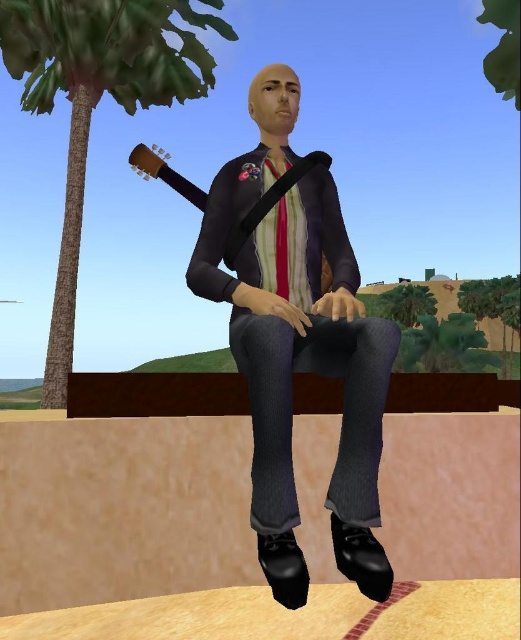
You are a game character trying to pick up the wooden acoustic guitar at center. The game requires you to move your hand from the matte black jacket at center to the guitar. In which direction should you move your hand relative to the jacket?

You should move your hand to the left from the matte black jacket at center to reach the wooden acoustic guitar at center since the jacket is positioned to the right of the guitar.